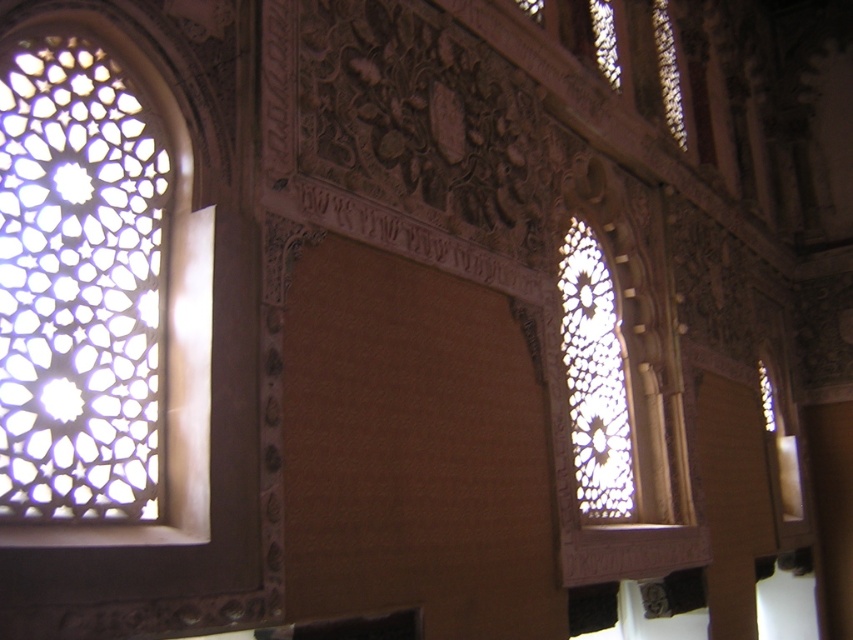
You are an architect analyzing the building structure. You observe the transparent glass window at left and the transparent glass window at right. Which one is positioned higher in the wall structure?

The transparent glass window at left is positioned higher in the wall structure as it is above the transparent glass window at right.